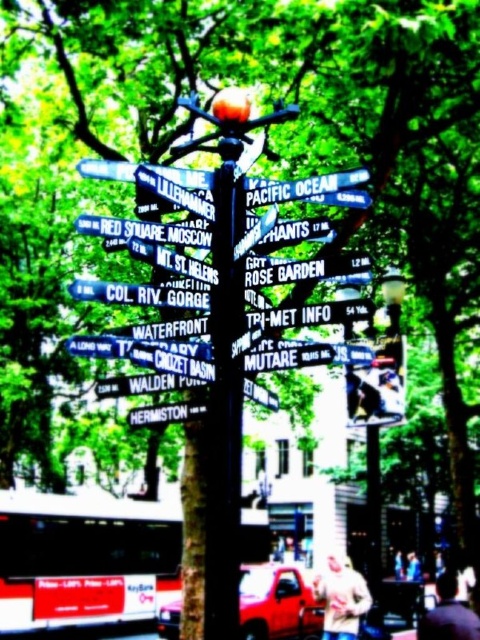
Question: Does black plastic street signs at center lie in front of light beige sweater at lower center?

Choices:
 (A) no
 (B) yes

Answer: (B)

Question: Is black plastic street signs at center closer to camera compared to dark brown leather jacket at lower right?

Choices:
 (A) yes
 (B) no

Answer: (A)

Question: Which point is closer to the camera taking this photo?

Choices:
 (A) (142, 202)
 (B) (450, 624)
 (C) (172, 324)

Answer: (C)

Question: Among these points, which one is nearest to the camera?

Choices:
 (A) pos(135,189)
 (B) pos(327,586)

Answer: (A)

Question: Does dark brown leather jacket at lower right have a greater width compared to green matte street sign at center?

Choices:
 (A) yes
 (B) no

Answer: (A)

Question: Which point is closer to the camera taking this photo?

Choices:
 (A) (143, 420)
 (B) (458, 634)
 (C) (292, 180)
 (D) (324, 592)

Answer: (C)